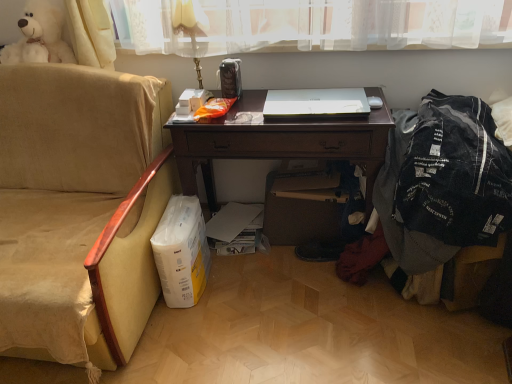
Question: From the image's perspective, is beige fabric chair at left under gold metallic table lamp at upper center?

Choices:
 (A) no
 (B) yes

Answer: (B)

Question: Can you confirm if beige fabric chair at left is positioned to the left of gold metallic table lamp at upper center?

Choices:
 (A) yes
 (B) no

Answer: (A)

Question: Is beige fabric chair at left surrounding gold metallic table lamp at upper center?

Choices:
 (A) no
 (B) yes

Answer: (A)

Question: From the image's perspective, is beige fabric chair at left on gold metallic table lamp at upper center?

Choices:
 (A) yes
 (B) no

Answer: (B)

Question: Considering the relative sizes of beige fabric chair at left and gold metallic table lamp at upper center in the image provided, is beige fabric chair at left bigger than gold metallic table lamp at upper center?

Choices:
 (A) yes
 (B) no

Answer: (A)

Question: In terms of width, does beige fabric chair at left look wider or thinner when compared to white glossy laptop at center?

Choices:
 (A) wide
 (B) thin

Answer: (A)

Question: From the image's perspective, is beige fabric chair at left located above or below white glossy laptop at center?

Choices:
 (A) below
 (B) above

Answer: (A)

Question: From a real-world perspective, is beige fabric chair at left physically located above or below white glossy laptop at center?

Choices:
 (A) below
 (B) above

Answer: (A)

Question: Visually, is beige fabric chair at left positioned to the left or to the right of white glossy laptop at center?

Choices:
 (A) left
 (B) right

Answer: (A)

Question: Considering the positions of beige fabric chair at left and brown cardboard box at lower center in the image, is beige fabric chair at left wider or thinner than brown cardboard box at lower center?

Choices:
 (A) wide
 (B) thin

Answer: (A)

Question: Is point (78, 284) positioned closer to the camera than point (318, 213)?

Choices:
 (A) farther
 (B) closer

Answer: (B)

Question: From a real-world perspective, is beige fabric chair at left physically located above or below brown cardboard box at lower center?

Choices:
 (A) above
 (B) below

Answer: (A)

Question: Is beige fabric chair at left situated inside brown cardboard box at lower center or outside?

Choices:
 (A) inside
 (B) outside

Answer: (B)

Question: Considering the positions of white glossy laptop at center and denim jacket at right in the image, is white glossy laptop at center wider or thinner than denim jacket at right?

Choices:
 (A) wide
 (B) thin

Answer: (B)

Question: Choose the correct answer: Is white glossy laptop at center inside denim jacket at right or outside it?

Choices:
 (A) outside
 (B) inside

Answer: (A)